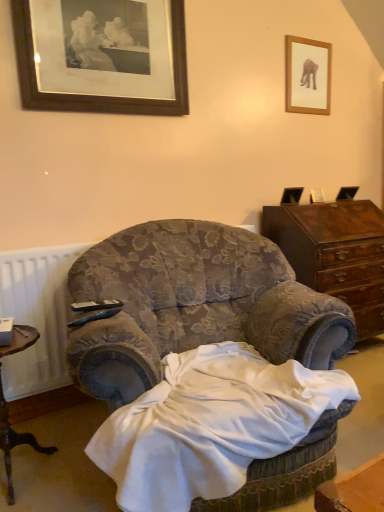
Question: In terms of width, does dark brown wood cabinet at right look wider or thinner when compared to velvet floral armchair at center?

Choices:
 (A) wide
 (B) thin

Answer: (B)

Question: Considering the positions of point (354, 284) and point (147, 249), is point (354, 284) closer or farther from the camera than point (147, 249)?

Choices:
 (A) farther
 (B) closer

Answer: (A)

Question: Which is nearer to the dark brown wood cabinet at right?

Choices:
 (A) wooden picture frame at upper right, which is counted as the 1th picture frame, starting from the right
 (B) brown wooden desk at lower left
 (C) wooden picture frame at upper left, the first picture frame from the left
 (D) black plastic remote control at center, the 1th remote control in the back-to-front sequence
 (E) black plastic remote control at lower left, acting as the 2th remote control starting from the back

Answer: (A)

Question: Considering the real-world distances, which object is farthest from the dark brown wood cabinet at right?

Choices:
 (A) velvet floral armchair at center
 (B) wooden picture frame at upper left, arranged as the 1th picture frame when viewed from the front
 (C) wooden picture frame at upper right, the second picture frame from the left
 (D) black plastic remote control at lower left, acting as the 2th remote control starting from the back
 (E) brown wooden desk at lower left

Answer: (E)